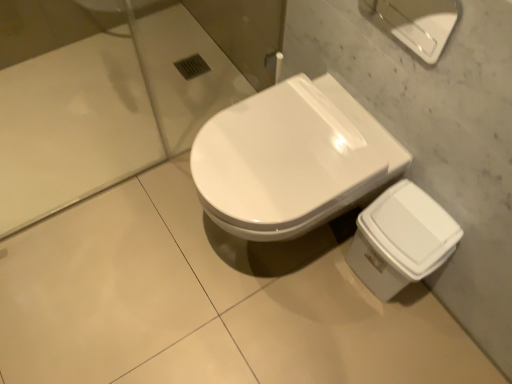
Describe the element at coordinates (416, 23) in the screenshot. I see `white glossy porcelain at upper right, the first porcelain when ordered from top to bottom` at that location.

Measure the distance between point (381, 6) and camera.

A distance of 3.99 feet exists between point (381, 6) and camera.

In order to face white glossy toilet at center, should I rotate leftwards or rightwards?

A 3.395 degree turn to the right will do.

What are the coordinates of `white glossy porcelain at upper right, the first porcelain when ordered from top to bottom` in the screenshot? It's located at (416, 23).

Which point is more forward, (279, 211) or (395, 235)?

The point (279, 211) is closer to the camera.

Identify the location of toilet located in front of the white glossy trash can at lower right, the first porcelain positioned from the back. (291, 159).

Can you tell me how much white glossy toilet at center and white glossy trash can at lower right, the second porcelain viewed from the top, differ in facing direction?

There is a 0.000696-degree angle between the facing directions of white glossy toilet at center and white glossy trash can at lower right, the second porcelain viewed from the top.

Consider the image. Is white glossy trash can at lower right, the first porcelain positioned from the back, shorter than white glossy toilet at center?

Indeed, white glossy trash can at lower right, the first porcelain positioned from the back, has a lesser height compared to white glossy toilet at center.

Would you say white glossy trash can at lower right, the second porcelain viewed from the top, is outside white glossy toilet at center?

Yes, white glossy trash can at lower right, the second porcelain viewed from the top, is not within white glossy toilet at center.

From a real-world perspective, who is located higher, white glossy trash can at lower right, the second porcelain viewed from the top, or white glossy toilet at center?

white glossy toilet at center, from a real-world perspective.

Between white glossy trash can at lower right, the first porcelain positioned from the back, and white glossy porcelain at upper right, which is the second porcelain from bottom to top, which one has less height?

white glossy porcelain at upper right, which is the second porcelain from bottom to top.

Which object is thinner, white glossy trash can at lower right, which is the 2th porcelain in front-to-back order, or white glossy porcelain at upper right, the first porcelain in the front-to-back sequence?

With smaller width is white glossy porcelain at upper right, the first porcelain in the front-to-back sequence.

In the scene shown: Is white glossy trash can at lower right, the 1th porcelain from the bottom, turned away from white glossy porcelain at upper right, the first porcelain in the front-to-back sequence?

No, white glossy trash can at lower right, the 1th porcelain from the bottom, is not facing away from white glossy porcelain at upper right, the first porcelain in the front-to-back sequence.

Does point (371, 252) come in front of point (385, 14)?

Yes, it is.

Would you say white glossy toilet at center is a long distance from white glossy porcelain at upper right, the first porcelain when ordered from top to bottom?

white glossy toilet at center is actually quite close to white glossy porcelain at upper right, the first porcelain when ordered from top to bottom.

Which point is more distant from viewer, [335,92] or [380,5]?

Positioned behind is point [335,92].

Between white glossy toilet at center and white glossy porcelain at upper right, which is the second porcelain from bottom to top, which one has larger width?

white glossy toilet at center is wider.

In the scene shown: Could you measure the distance between white glossy porcelain at upper right, which is the second porcelain in back-to-front order, and white glossy toilet at center?

white glossy porcelain at upper right, which is the second porcelain in back-to-front order, and white glossy toilet at center are 13.70 inches apart.

The height and width of the screenshot is (384, 512). In order to click on toilet located behind the white glossy porcelain at upper right, the first porcelain when ordered from top to bottom in this screenshot , I will do `click(291, 159)`.

Which point is more distant from viewer, (430,37) or (234,191)?

The point (430,37) is more distant.

Is white glossy porcelain at upper right, the first porcelain when ordered from top to bottom, at the left side of white glossy toilet at center?

No.

From the image's perspective, would you say white glossy porcelain at upper right, the first porcelain when ordered from top to bottom, is positioned over white glossy trash can at lower right, the first porcelain positioned from the back?

Yes, from the image's perspective, white glossy porcelain at upper right, the first porcelain when ordered from top to bottom, is above white glossy trash can at lower right, the first porcelain positioned from the back.

Which object is more forward, white glossy porcelain at upper right, which is the second porcelain from bottom to top, or white glossy trash can at lower right, the 1th porcelain from the bottom?

white glossy porcelain at upper right, which is the second porcelain from bottom to top.

Is white glossy porcelain at upper right, the first porcelain when ordered from top to bottom, oriented towards white glossy trash can at lower right, the second porcelain viewed from the top?

No, white glossy porcelain at upper right, the first porcelain when ordered from top to bottom, does not turn towards white glossy trash can at lower right, the second porcelain viewed from the top.

You are a GUI agent. You are given a task and a screenshot of the screen. Output one action in this format:
    pyautogui.click(x=<x>, y=<y>)
    Task: Click on the porcelain that is the 2nd object to the right of the white glossy toilet at center, starting at the anchor
    This screenshot has width=512, height=384.
    Given the screenshot: What is the action you would take?
    pyautogui.click(x=401, y=239)

At what (x,y) coordinates should I click in order to perform the action: click on toilet on the left of white glossy trash can at lower right, the 1th porcelain from the bottom. Please return your answer as a coordinate pair (x, y). This screenshot has width=512, height=384. Looking at the image, I should click on (291, 159).

From the picture: Based on their spatial positions, is white glossy trash can at lower right, the 1th porcelain from the bottom, or white glossy toilet at center further from white glossy porcelain at upper right, the first porcelain when ordered from top to bottom?

white glossy trash can at lower right, the 1th porcelain from the bottom, is further to white glossy porcelain at upper right, the first porcelain when ordered from top to bottom.

Looking at the image, which one is located further to white glossy toilet at center, white glossy trash can at lower right, the 1th porcelain from the bottom, or white glossy porcelain at upper right, which is the second porcelain from bottom to top?

white glossy porcelain at upper right, which is the second porcelain from bottom to top, is positioned further to the anchor white glossy toilet at center.

Estimate the real-world distances between objects in this image. Which object is closer to white glossy trash can at lower right, the second porcelain viewed from the top, white glossy porcelain at upper right, the first porcelain in the front-to-back sequence, or white glossy toilet at center?

white glossy toilet at center is positioned closer to the anchor white glossy trash can at lower right, the second porcelain viewed from the top.

Looking at the image, which one is located closer to white glossy trash can at lower right, the second porcelain viewed from the top, white glossy toilet at center or white glossy porcelain at upper right, which is the second porcelain from bottom to top?

Based on the image, white glossy toilet at center appears to be nearer to white glossy trash can at lower right, the second porcelain viewed from the top.

Looking at the image, which one is located further to white glossy toilet at center, white glossy porcelain at upper right, which is the second porcelain in back-to-front order, or white glossy trash can at lower right, the second porcelain viewed from the top?

white glossy porcelain at upper right, which is the second porcelain in back-to-front order.

From the image, which object appears to be farther from white glossy porcelain at upper right, which is the second porcelain from bottom to top, white glossy toilet at center or white glossy trash can at lower right, the first porcelain positioned from the back?

The object further to white glossy porcelain at upper right, which is the second porcelain from bottom to top, is white glossy trash can at lower right, the first porcelain positioned from the back.

You are a GUI agent. You are given a task and a screenshot of the screen. Output one action in this format:
    pyautogui.click(x=<x>, y=<y>)
    Task: Click on the toilet between white glossy porcelain at upper right, the first porcelain when ordered from top to bottom, and white glossy trash can at lower right, the second porcelain viewed from the top, vertically
    This screenshot has width=512, height=384.
    Given the screenshot: What is the action you would take?
    pyautogui.click(x=291, y=159)